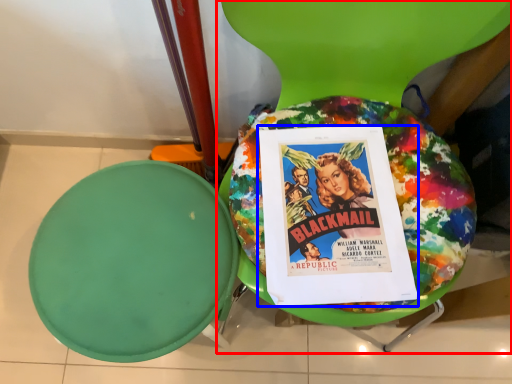
Question: Among these objects, which one is farthest to the camera, chair (highlighted by a red box) or comic book (highlighted by a blue box)?

Choices:
 (A) chair
 (B) comic book

Answer: (B)